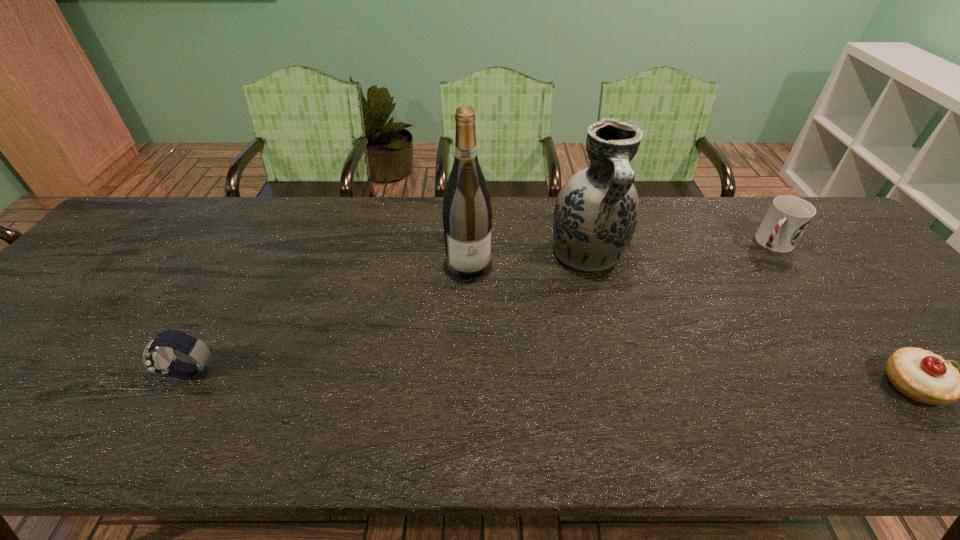
You are a GUI agent. You are given a task and a screenshot of the screen. Output one action in this format:
    pyautogui.click(x=<x>, y=<y>)
    Task: Click on the vacant area situated with the handle on the side of the vase
    Image resolution: width=960 pixels, height=540 pixels.
    Given the screenshot: What is the action you would take?
    pyautogui.click(x=615, y=318)

The width and height of the screenshot is (960, 540). Identify the location of free point located on the label of the wine bottle. (480, 307).

Identify the location of free space located on the label of the wine bottle. (476, 293).

Image resolution: width=960 pixels, height=540 pixels. I want to click on free region located 0.190m on the label of the wine bottle, so click(487, 335).

Find the location of `free space located on the handle side of the cup`. free space located on the handle side of the cup is located at coordinates (706, 319).

The image size is (960, 540). In order to click on vacant space positioned on the handle side of the cup in this screenshot , I will do `click(740, 280)`.

Where is `free space located on the handle side of the cup`? Image resolution: width=960 pixels, height=540 pixels. free space located on the handle side of the cup is located at coordinates (720, 302).

At what (x,y) coordinates should I click in order to perform the action: click on vase that is at the far edge. Please return your answer as a coordinate pair (x, y). The height and width of the screenshot is (540, 960). Looking at the image, I should click on (596, 212).

The height and width of the screenshot is (540, 960). I want to click on cup at the far edge, so click(786, 220).

Locate an element on the screen. Image resolution: width=960 pixels, height=540 pixels. object that is positioned at the near edge is located at coordinates (158, 357).